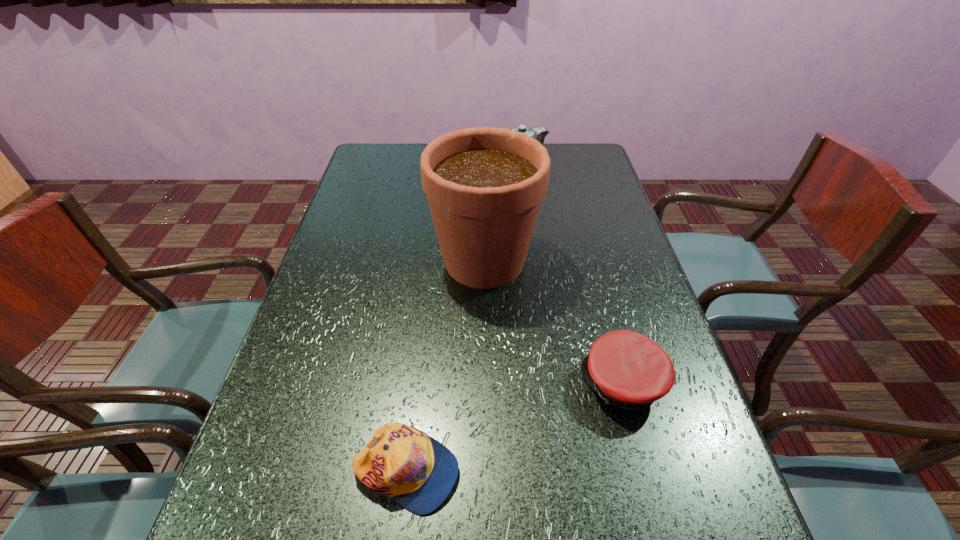
Identify the location of vacant space at the far left corner of the desktop. (371, 159).

This screenshot has height=540, width=960. Identify the location of free space between the nearer cap and the flowerpot. (445, 366).

Find the location of a particular element. empty location between the nearest object and the tallest object is located at coordinates (445, 366).

You are a GUI agent. You are given a task and a screenshot of the screen. Output one action in this format:
    pyautogui.click(x=<x>, y=<y>)
    Task: Click on the empty space that is in between the right cap and the left cap
    
    Given the screenshot: What is the action you would take?
    pyautogui.click(x=515, y=428)

The width and height of the screenshot is (960, 540). Find the location of `vacant area that lies between the left cap and the tallest object`. vacant area that lies between the left cap and the tallest object is located at coordinates (445, 366).

Identify the location of free area in between the third shortest object and the farther cap. (571, 273).

The height and width of the screenshot is (540, 960). Find the location of `free spot between the nearer cap and the tallest object`. free spot between the nearer cap and the tallest object is located at coordinates click(x=445, y=366).

Image resolution: width=960 pixels, height=540 pixels. Identify the location of unoccupied position between the flowerpot and the nearest object. (445, 366).

Locate which object ranks third in proximity to the second nearest object. Please provide its 2D coordinates. Your answer should be formatted as a tuple, i.e. [(x, y)], where the tuple contains the x and y coordinates of a point satisfying the conditions above.

[(539, 133)]

Locate an element on the screen. object that ranks as the third closest to the farthest object is located at coordinates (415, 470).